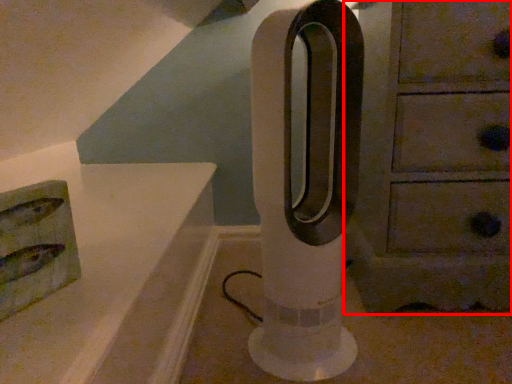
Question: From the image's perspective, what is the correct spatial relationship of chest of drawers (annotated by the red box) in relation to pillar?

Choices:
 (A) below
 (B) above

Answer: (B)